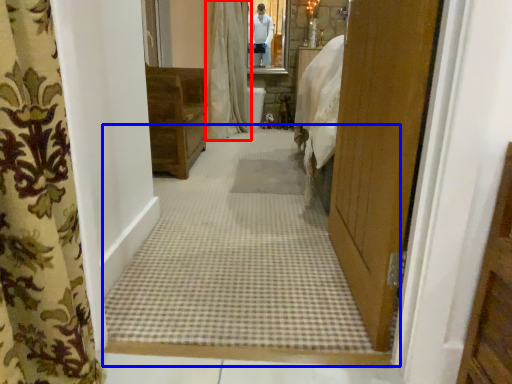
Question: Which of the following is the farthest to the observer, curtain (highlighted by a red box) or plain (highlighted by a blue box)?

Choices:
 (A) curtain
 (B) plain

Answer: (A)